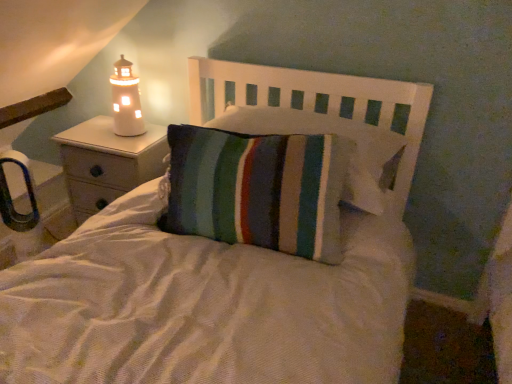
Question: Is striped fabric pillow at center oriented away from white ceramic lighthouse at left?

Choices:
 (A) no
 (B) yes

Answer: (A)

Question: Considering the relative sizes of striped fabric pillow at center and white ceramic lighthouse at left in the image provided, is striped fabric pillow at center bigger than white ceramic lighthouse at left?

Choices:
 (A) no
 (B) yes

Answer: (B)

Question: Is striped fabric pillow at center not near white ceramic lighthouse at left?

Choices:
 (A) no
 (B) yes

Answer: (A)

Question: Is striped fabric pillow at center further to camera compared to white ceramic lighthouse at left?

Choices:
 (A) no
 (B) yes

Answer: (A)

Question: From a real-world perspective, does striped fabric pillow at center sit lower than white ceramic lighthouse at left?

Choices:
 (A) no
 (B) yes

Answer: (B)

Question: Would you say matte white nightstand at left is to the left or to the right of white ceramic lighthouse at left in the picture?

Choices:
 (A) right
 (B) left

Answer: (B)

Question: In terms of width, does matte white nightstand at left look wider or thinner when compared to white ceramic lighthouse at left?

Choices:
 (A) wide
 (B) thin

Answer: (A)

Question: Considering the positions of matte white nightstand at left and white ceramic lighthouse at left in the image, is matte white nightstand at left taller or shorter than white ceramic lighthouse at left?

Choices:
 (A) tall
 (B) short

Answer: (A)

Question: In terms of size, does matte white nightstand at left appear bigger or smaller than white ceramic lighthouse at left?

Choices:
 (A) small
 (B) big

Answer: (B)

Question: Is white ceramic lighthouse at left bigger or smaller than striped fabric pillow at center?

Choices:
 (A) big
 (B) small

Answer: (B)

Question: From a real-world perspective, is white ceramic lighthouse at left above or below striped fabric pillow at center?

Choices:
 (A) below
 (B) above

Answer: (B)

Question: Considering their positions, is white ceramic lighthouse at left located in front of or behind striped fabric pillow at center?

Choices:
 (A) front
 (B) behind

Answer: (B)

Question: Is point (112, 102) positioned closer to the camera than point (105, 379)?

Choices:
 (A) closer
 (B) farther

Answer: (B)

Question: Is striped fabric pillow at center taller or shorter than striped fabric pillow at center?

Choices:
 (A) tall
 (B) short

Answer: (B)

Question: Is point (350, 137) positioned closer to the camera than point (158, 268)?

Choices:
 (A) farther
 (B) closer

Answer: (A)